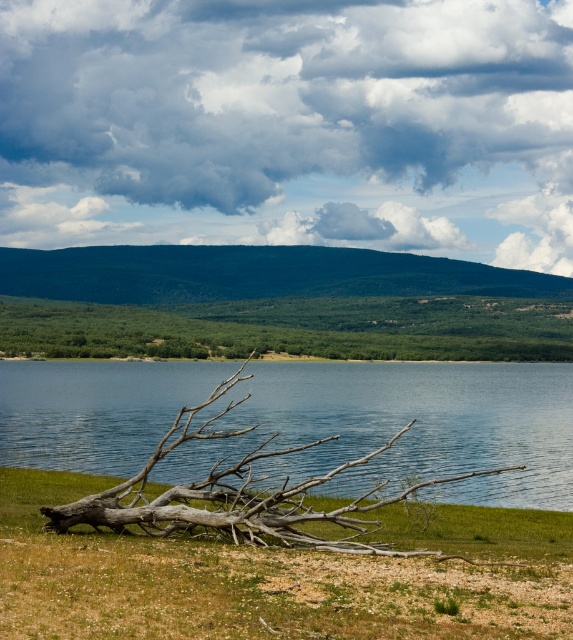
Question: Is clear blue water at center below green leafy tree at center?

Choices:
 (A) yes
 (B) no

Answer: (A)

Question: Which object appears closest to the camera in this image?

Choices:
 (A) clear blue water at center
 (B) green leafy tree at center
 (C) cloudy sky at upper center

Answer: (A)

Question: Which of the following is the farthest from the observer?

Choices:
 (A) (414, 93)
 (B) (117, 420)

Answer: (A)

Question: Is cloudy sky at upper center bigger than clear blue water at center?

Choices:
 (A) no
 (B) yes

Answer: (B)

Question: Among these objects, which one is nearest to the camera?

Choices:
 (A) green leafy tree at center
 (B) cloudy sky at upper center
 (C) clear blue water at center

Answer: (C)

Question: Is cloudy sky at upper center below clear blue water at center?

Choices:
 (A) no
 (B) yes

Answer: (A)